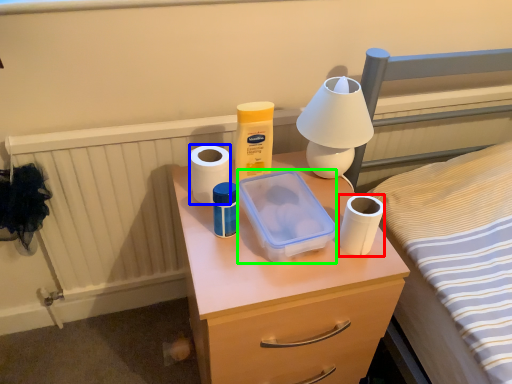
Question: Which object is positioned closest to toilet paper (highlighted by a red box)? Select from toilet paper (highlighted by a blue box) and storage box (highlighted by a green box).

Choices:
 (A) toilet paper
 (B) storage box

Answer: (B)